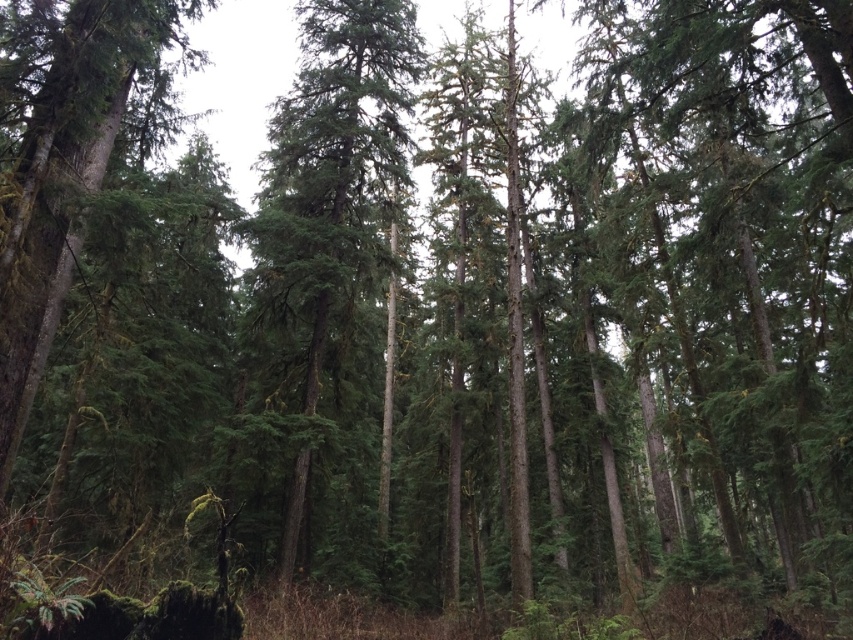
Question: Is green needle-like at center positioned behind green matte tree at left?

Choices:
 (A) yes
 (B) no

Answer: (A)

Question: Which of the following is the farthest from the observer?

Choices:
 (A) green matte tree at left
 (B) green needle-like at center

Answer: (B)

Question: Is green needle-like at center smaller than green matte tree at left?

Choices:
 (A) yes
 (B) no

Answer: (B)

Question: Where is green needle-like at center located in relation to green matte tree at left in the image?

Choices:
 (A) below
 (B) above

Answer: (A)